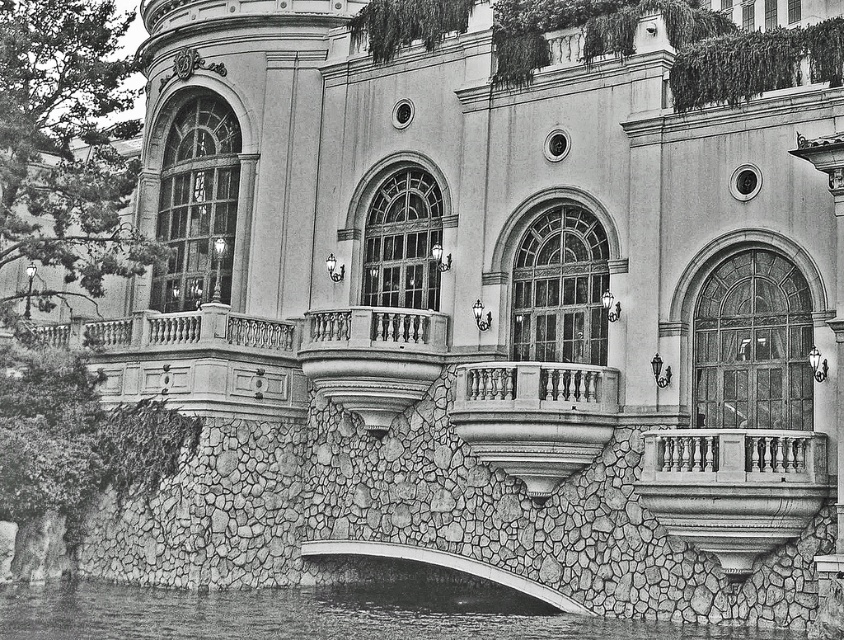
Looking at this image, is smooth stone balcony at center below white stone bridge at center?

Actually, smooth stone balcony at center is above white stone bridge at center.

This screenshot has width=844, height=640. What do you see at coordinates (534, 388) in the screenshot?
I see `smooth stone balcony at center` at bounding box center [534, 388].

Locate an element on the screen. The image size is (844, 640). smooth stone balcony at center is located at coordinates (534, 388).

At what (x,y) coordinates should I click in order to perform the action: click on smooth stone balcony at center. Please return your answer as a coordinate pair (x, y). The height and width of the screenshot is (640, 844). Looking at the image, I should click on (534, 388).

How far apart are clear water at lower center and white stone bridge at center?

clear water at lower center and white stone bridge at center are 6.51 meters apart.

You are a GUI agent. You are given a task and a screenshot of the screen. Output one action in this format:
    pyautogui.click(x=<x>, y=<y>)
    Task: Click on the clear water at lower center
    
    Given the screenshot: What is the action you would take?
    pyautogui.click(x=318, y=612)

At what (x,y) coordinates should I click in order to perform the action: click on clear water at lower center. Please return your answer as a coordinate pair (x, y). The image size is (844, 640). Looking at the image, I should click on (318, 612).

How much distance is there between clear water at lower center and smooth stone balcony at center?

11.30 meters

Does clear water at lower center appear under smooth stone balcony at center?

Yes.

In order to click on clear water at lower center in this screenshot , I will do `click(318, 612)`.